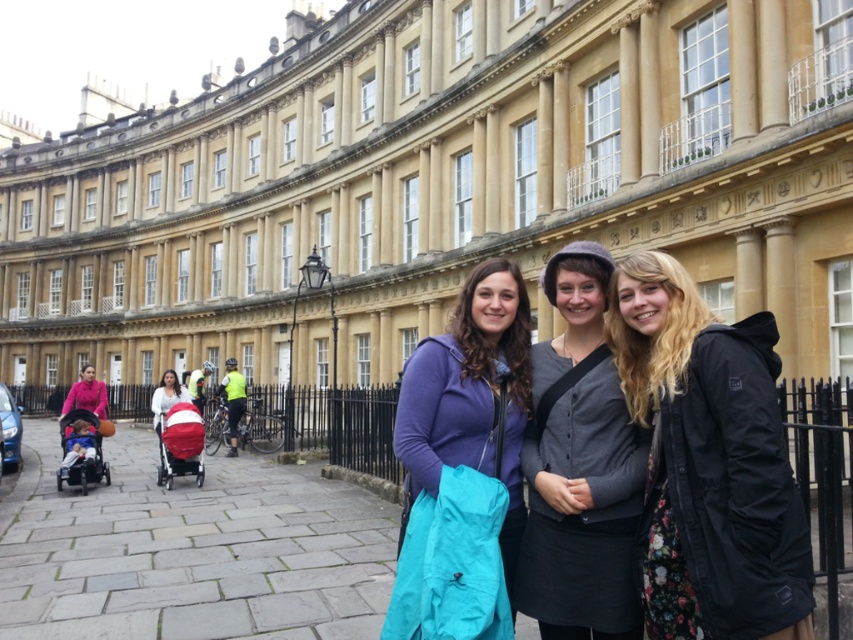
Does point (548, 412) lie behind point (68, 474)?

No.

Identify the location of gray matte cardigan at center. (579, 467).

Is the position of matte purple jacket at center more distant than that of red fabric baby carriage at left?

No, matte purple jacket at center is in front of red fabric baby carriage at left.

Does matte purple jacket at center have a greater width compared to red fabric baby carriage at left?

Yes, matte purple jacket at center is wider than red fabric baby carriage at left.

Is point (428, 426) closer to viewer compared to point (165, 460)?

Yes, point (428, 426) is closer to viewer.

The width and height of the screenshot is (853, 640). Identify the location of matte purple jacket at center. coord(461,385).

Does red fabric baby carriage at left appear over matte white stroller at left?

No.

Who is more distant from viewer, (196, 461) or (155, 404)?

The point (155, 404) is more distant.

Locate an element on the screen. The image size is (853, 640). red fabric baby carriage at left is located at coordinates (180, 444).